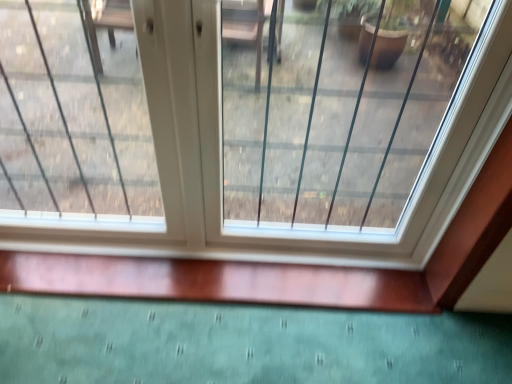
At what (x,y) coordinates should I click in order to perform the action: click on clear glass window at center. Please return your answer as a coordinate pair (x, y). This screenshot has width=512, height=384. Looking at the image, I should click on (336, 105).

The height and width of the screenshot is (384, 512). Describe the element at coordinates (336, 105) in the screenshot. I see `clear glass window at center` at that location.

At what (x,y) coordinates should I click in order to perform the action: click on transparent glass window at center. Please return your answer as a coordinate pair (x, y). The image size is (512, 384). Looking at the image, I should click on (221, 160).

This screenshot has width=512, height=384. Describe the element at coordinates (221, 160) in the screenshot. I see `transparent glass window at center` at that location.

Image resolution: width=512 pixels, height=384 pixels. I want to click on clear glass window at center, so click(336, 105).

Is clear glass window at center to the right of transparent glass window at center from the viewer's perspective?

Indeed, clear glass window at center is positioned on the right side of transparent glass window at center.

In the scene shown: Relative to transparent glass window at center, is clear glass window at center in front or behind?

clear glass window at center is in front of transparent glass window at center.

Between point (260, 63) and point (425, 196), which one is positioned in front?

The point (425, 196) is closer.

From the image's perspective, which object appears higher, clear glass window at center or transparent glass window at center?

clear glass window at center is shown above in the image.

From the picture: From a real-world perspective, is clear glass window at center over transparent glass window at center?

Yes.

Which object is thinner, clear glass window at center or transparent glass window at center?

With smaller width is transparent glass window at center.

Considering the sizes of objects clear glass window at center and transparent glass window at center in the image provided, who is shorter, clear glass window at center or transparent glass window at center?

Standing shorter between the two is clear glass window at center.

Considering the sizes of clear glass window at center and transparent glass window at center in the image, is clear glass window at center bigger or smaller than transparent glass window at center?

clear glass window at center is bigger than transparent glass window at center.

Is clear glass window at center not inside transparent glass window at center?

No, clear glass window at center is inside or overlapping with transparent glass window at center.

Is clear glass window at center not close to transparent glass window at center?

Indeed, clear glass window at center is not near transparent glass window at center.

Could you tell me if clear glass window at center is turned towards transparent glass window at center?

Yes, clear glass window at center is turned towards transparent glass window at center.

How far apart are clear glass window at center and transparent glass window at center?

A distance of 4.70 feet exists between clear glass window at center and transparent glass window at center.

Locate an element on the screen. The image size is (512, 384). glass window above the transparent glass window at center (from a real-world perspective) is located at coordinates (336, 105).

Can you confirm if transparent glass window at center is positioned to the right of clear glass window at center?

In fact, transparent glass window at center is to the left of clear glass window at center.

From the picture: Considering the positions of objects transparent glass window at center and clear glass window at center in the image provided, who is in front, transparent glass window at center or clear glass window at center?

clear glass window at center is closer to the camera.

Which is closer, (489,131) or (309,66)?

Point (489,131) is closer to the camera than point (309,66).

From the image's perspective, who appears lower, transparent glass window at center or clear glass window at center?

transparent glass window at center appears lower in the image.

From a real-world perspective, between transparent glass window at center and clear glass window at center, who is vertically higher?

In real-world perspective, clear glass window at center is above.

Looking at their sizes, would you say transparent glass window at center is wider or thinner than clear glass window at center?

In the image, transparent glass window at center appears to be more narrow than clear glass window at center.

Does transparent glass window at center have a lesser height compared to clear glass window at center?

No, transparent glass window at center is not shorter than clear glass window at center.

Considering the relative sizes of transparent glass window at center and clear glass window at center in the image provided, is transparent glass window at center smaller than clear glass window at center?

Correct, transparent glass window at center occupies less space than clear glass window at center.

Which is correct: transparent glass window at center is inside clear glass window at center, or outside of it?

transparent glass window at center is spatially positioned inside clear glass window at center.

Is transparent glass window at center not near clear glass window at center?

Yes, transparent glass window at center is far from clear glass window at center.

Looking at this image, is transparent glass window at center aimed at clear glass window at center?

Yes.

What's the angular difference between transparent glass window at center and clear glass window at center's facing directions?

The angle between the facing direction of transparent glass window at center and the facing direction of clear glass window at center is 0.0324 degrees.

The image size is (512, 384). What are the coordinates of `window below the clear glass window at center (from a real-world perspective)` in the screenshot? It's located at (221, 160).

Identify the location of glass window above the transparent glass window at center (from a real-world perspective). The height and width of the screenshot is (384, 512). (336, 105).

This screenshot has height=384, width=512. I want to click on window that appears on the left of clear glass window at center, so click(221, 160).